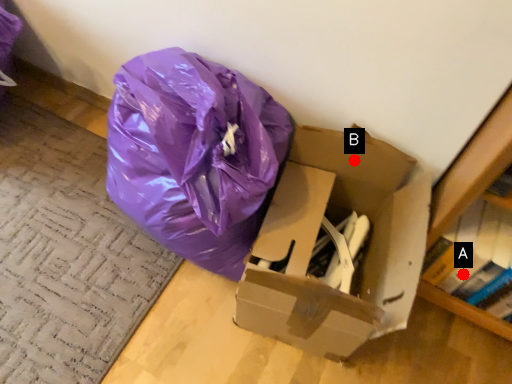
Question: Two points are circled on the image, labeled by A and B beside each circle. Which point is closer to the camera taking this photo?

Choices:
 (A) A is closer
 (B) B is closer

Answer: (A)